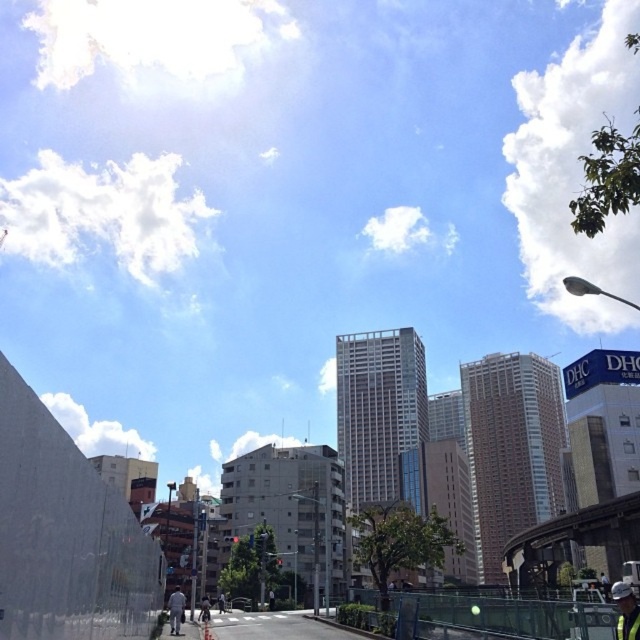
Question: Can you confirm if hard hat at center is positioned to the left of white fabric man at lower center?

Choices:
 (A) yes
 (B) no

Answer: (B)

Question: Considering the relative positions of hard hat at center and white fabric man at lower center in the image provided, where is hard hat at center located with respect to white fabric man at lower center?

Choices:
 (A) below
 (B) above

Answer: (B)

Question: Which point is farther to the camera?

Choices:
 (A) (621, 589)
 (B) (173, 628)

Answer: (B)

Question: Which of the following is the farthest from the observer?

Choices:
 (A) white fabric man at lower center
 (B) hard hat at center

Answer: (A)

Question: Can you confirm if hard hat at center is positioned to the right of white fabric man at lower center?

Choices:
 (A) yes
 (B) no

Answer: (A)